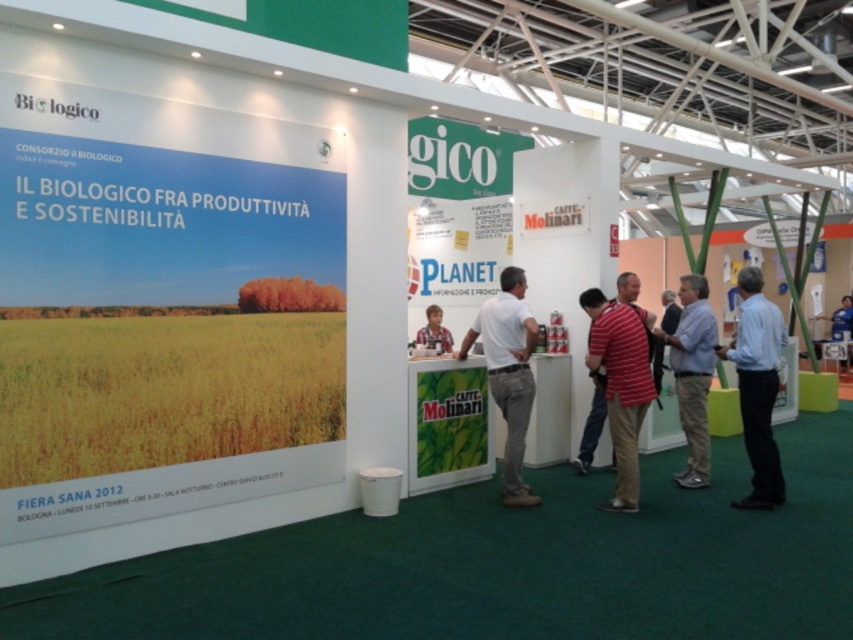
Between point (750, 426) and point (686, 417), which one is positioned in front?

Positioned in front is point (750, 426).

Between blue shirt at right and light blue shirt at center, which one appears on the left side from the viewer's perspective?

From the viewer's perspective, light blue shirt at center appears more on the left side.

Which is in front, point (747, 321) or point (675, 330)?

Point (747, 321)

Locate an element on the screen. The width and height of the screenshot is (853, 640). blue shirt at right is located at coordinates click(757, 387).

Is light brown wooden chair at center above blue fabric shirt at right?

No, light brown wooden chair at center is not above blue fabric shirt at right.

Between point (436, 339) and point (833, 332), which one is positioned behind?

Point (833, 332)

You are a GUI agent. You are given a task and a screenshot of the screen. Output one action in this format:
    pyautogui.click(x=<x>, y=<y>)
    Task: Click on the light brown wooden chair at center
    The height and width of the screenshot is (640, 853).
    Given the screenshot: What is the action you would take?
    pyautogui.click(x=434, y=332)

Is point (512, 461) farther from camera compared to point (693, 401)?

No, it is in front of (693, 401).

This screenshot has height=640, width=853. What do you see at coordinates (508, 372) in the screenshot? I see `white matte shirt at center` at bounding box center [508, 372].

Between point (524, 324) and point (683, 394), which one is positioned behind?

Point (683, 394)

At what (x,y) coordinates should I click in order to perform the action: click on white matte shirt at center. Please return your answer as a coordinate pair (x, y). The image size is (853, 640). Looking at the image, I should click on (x=508, y=372).